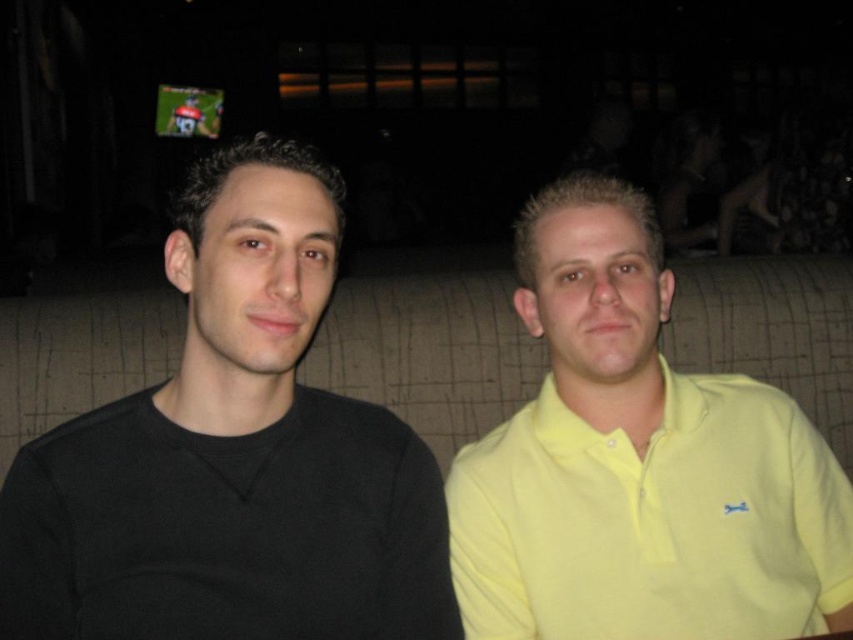
Can you confirm if black matte sweater at left is thinner than yellow matte shirt at right?

Yes.

Is black matte sweater at left taller than yellow matte shirt at right?

Correct, black matte sweater at left is much taller as yellow matte shirt at right.

Image resolution: width=853 pixels, height=640 pixels. In order to click on black matte sweater at left in this screenshot , I will do `click(233, 456)`.

Where is `black matte sweater at left`? The height and width of the screenshot is (640, 853). black matte sweater at left is located at coordinates (233, 456).